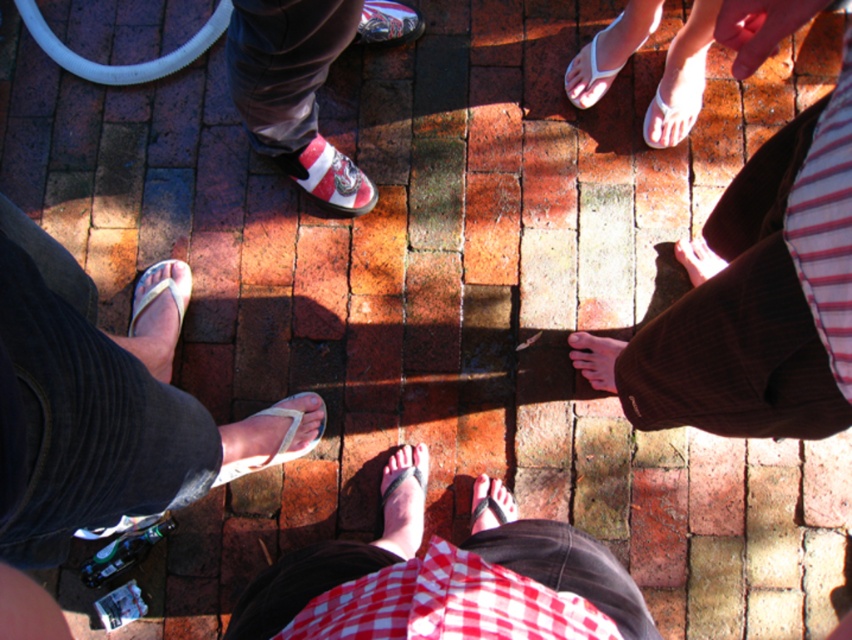
Question: Which object appears farthest from the camera in this image?

Choices:
 (A) matte pink sandal at center
 (B) matte white and red sneaker at center

Answer: (B)

Question: Is white rubber flip-flop at lower left smaller than shiny metallic shoe at center?

Choices:
 (A) no
 (B) yes

Answer: (A)

Question: Where is red checkered shorts at center located in relation to black rubber flip-flop at center in the image?

Choices:
 (A) above
 (B) below

Answer: (A)

Question: Does white sandal at lower center have a lesser width compared to black rubber flip-flop at center?

Choices:
 (A) no
 (B) yes

Answer: (A)

Question: Considering the real-world distances, which object is closest to the smooth brown skin at center?

Choices:
 (A) smooth skin hand at upper right
 (B) black rubber flip-flop at center
 (C) brown corduroy pants at center
 (D) matte pink sandal at center

Answer: (D)

Question: Which point appears closest to the camera in this image?

Choices:
 (A) (329, 196)
 (B) (514, 502)
 (C) (709, 252)
 (D) (681, 29)

Answer: (D)